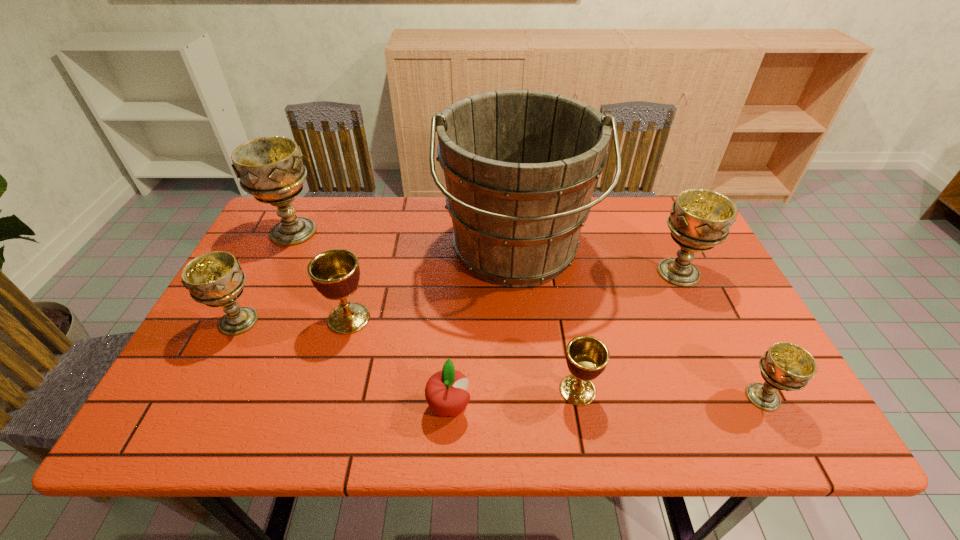
The image size is (960, 540). What are the coordinates of `bucket` in the screenshot? It's located at (520, 166).

Image resolution: width=960 pixels, height=540 pixels. I want to click on the farthest chalice, so click(270, 168).

The width and height of the screenshot is (960, 540). I want to click on the farthest white chalice, so click(270, 168).

The height and width of the screenshot is (540, 960). What are the coordinates of `the second biggest white chalice` in the screenshot? It's located at (699, 219).

Identify the location of the second farthest chalice. The width and height of the screenshot is (960, 540). (699, 219).

Identify the location of the third object from left to right. (335, 273).

Locate an element on the screen. The width and height of the screenshot is (960, 540). the farther golden chalice is located at coordinates (335, 273).

The image size is (960, 540). I want to click on the third biggest white chalice, so click(215, 279).

Identify the location of the right golden chalice. (587, 357).

The image size is (960, 540). I want to click on the third chalice from right to left, so click(587, 357).